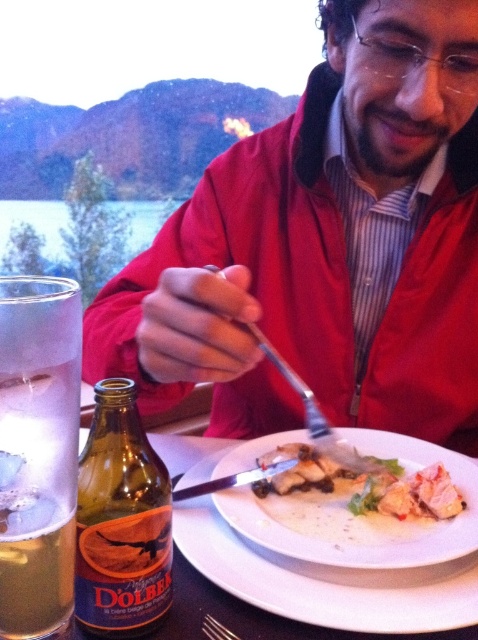
Question: Is matte red jacket at center to the right of satin silver fork at plate center from the viewer's perspective?

Choices:
 (A) yes
 (B) no

Answer: (B)

Question: Which point is closer to the camera?

Choices:
 (A) satin silver fork at plate center
 (B) white matte plate at center
 (C) matte red jacket at center
 (D) clear glass at upper left

Answer: (D)

Question: Which of the following is the closest to the observer?

Choices:
 (A) (362, 460)
 (B) (477, 42)
 (C) (31, 602)

Answer: (C)

Question: Can you confirm if clear glass at upper left is bigger than satin silver fork at plate center?

Choices:
 (A) no
 (B) yes

Answer: (A)

Question: Which point appears closest to the camera in this image?

Choices:
 (A) (14, 579)
 (B) (355, 449)

Answer: (A)

Question: Does white ceramic plate at center appear over brown glass bottle at lower left?

Choices:
 (A) yes
 (B) no

Answer: (B)